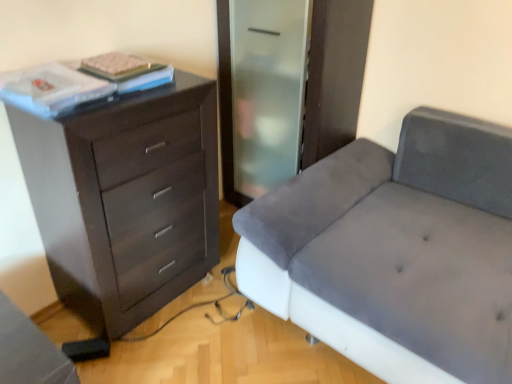
The image size is (512, 384). What do you see at coordinates (125, 201) in the screenshot? I see `dark wood chest of drawers at left` at bounding box center [125, 201].

The height and width of the screenshot is (384, 512). I want to click on dark wood chest of drawers at left, so click(x=125, y=201).

Who is smaller, white matte book at upper left or velvet grey couch at right?

With smaller size is white matte book at upper left.

Does white matte book at upper left turn towards velvet grey couch at right?

No, white matte book at upper left is not oriented towards velvet grey couch at right.

From a real-world perspective, is white matte book at upper left physically located above or below velvet grey couch at right?

white matte book at upper left is situated higher than velvet grey couch at right in the real world.

Choose the correct answer: Is white matte book at upper left inside velvet grey couch at right or outside it?

white matte book at upper left is located beyond the bounds of velvet grey couch at right.

In the scene shown: Considering the positions of objects velvet grey couch at right and dark wood chest of drawers at left in the image provided, who is more to the right, velvet grey couch at right or dark wood chest of drawers at left?

velvet grey couch at right is more to the right.

Who is bigger, velvet grey couch at right or dark wood chest of drawers at left?

With larger size is velvet grey couch at right.

Is velvet grey couch at right taller or shorter than dark wood chest of drawers at left?

Considering their sizes, velvet grey couch at right has less height than dark wood chest of drawers at left.

From a real-world perspective, is velvet grey couch at right over dark wood chest of drawers at left?

No, from a real-world perspective, velvet grey couch at right is not over dark wood chest of drawers at left

Locate an element on the screen. The image size is (512, 384). book above the dark wood chest of drawers at left (from the image's perspective) is located at coordinates 127,71.

From a real-world perspective, which is physically above, white matte book at upper left or dark wood chest of drawers at left?

From a 3D spatial view, white matte book at upper left is above.

From the image's perspective, which is below, white matte book at upper left or dark wood chest of drawers at left?

dark wood chest of drawers at left is shown below in the image.

Consider the image. Is dark wood chest of drawers at left wider or thinner than velvet grey couch at right?

In the image, dark wood chest of drawers at left appears to be more narrow than velvet grey couch at right.

Is dark wood chest of drawers at left inside the boundaries of velvet grey couch at right, or outside?

dark wood chest of drawers at left lies outside velvet grey couch at right.

The image size is (512, 384). What are the coordinates of `chest of drawers on the left of velvet grey couch at right` in the screenshot? It's located at (125, 201).

From the image's perspective, which one is positioned higher, dark wood chest of drawers at left or velvet grey couch at right?

dark wood chest of drawers at left.

Is velvet grey couch at right oriented away from white matte book at upper left?

That's not correct — velvet grey couch at right is not looking away from white matte book at upper left.

Is velvet grey couch at right to the left or to the right of white matte book at upper left in the image?

Based on their positions, velvet grey couch at right is located to the right of white matte book at upper left.

Does point (334, 300) appear closer or farther from the camera than point (137, 74)?

Point (334, 300) is closer to the camera than point (137, 74).

Does velvet grey couch at right contain white matte book at upper left?

That's incorrect, white matte book at upper left is not inside velvet grey couch at right.

Looking at this image, is dark wood chest of drawers at left positioned with its back to white matte book at upper left?

That's not correct — dark wood chest of drawers at left is not looking away from white matte book at upper left.

Considering the relative positions of dark wood chest of drawers at left and white matte book at upper left in the image provided, is dark wood chest of drawers at left to the left or to the right of white matte book at upper left?

dark wood chest of drawers at left is to the right of white matte book at upper left.

From a real-world perspective, who is located lower, dark wood chest of drawers at left or white matte book at upper left?

In real-world perspective, dark wood chest of drawers at left is lower.

Looking at the image, does dark wood chest of drawers at left seem bigger or smaller compared to white matte book at upper left?

Considering their sizes, dark wood chest of drawers at left takes up more space than white matte book at upper left.

You are a GUI agent. You are given a task and a screenshot of the screen. Output one action in this format:
    pyautogui.click(x=<x>, y=<y>)
    Task: Click on the studio couch that appears in front of the white matte book at upper left
    
    Given the screenshot: What is the action you would take?
    pyautogui.click(x=395, y=251)

Identify the location of chest of drawers to the left of velvet grey couch at right. (125, 201).

Estimate the real-world distances between objects in this image. Which object is closer to white matte book at upper left, velvet grey couch at right or dark wood chest of drawers at left?

Based on the image, dark wood chest of drawers at left appears to be nearer to white matte book at upper left.

Based on their spatial positions, is dark wood chest of drawers at left or velvet grey couch at right closer to white matte book at upper left?

Based on the image, dark wood chest of drawers at left appears to be nearer to white matte book at upper left.

Looking at the image, which one is located closer to velvet grey couch at right, white matte book at upper left or dark wood chest of drawers at left?

Based on the image, dark wood chest of drawers at left appears to be nearer to velvet grey couch at right.

Which object lies further to the anchor point dark wood chest of drawers at left, velvet grey couch at right or white matte book at upper left?

velvet grey couch at right is positioned further to the anchor dark wood chest of drawers at left.

Estimate the real-world distances between objects in this image. Which object is closer to dark wood chest of drawers at left, white matte book at upper left or velvet grey couch at right?

white matte book at upper left is positioned closer to the anchor dark wood chest of drawers at left.

Considering their positions, is dark wood chest of drawers at left positioned further to velvet grey couch at right than white matte book at upper left?

Based on the image, white matte book at upper left appears to be further to velvet grey couch at right.

Identify the location of chest of drawers between white matte book at upper left and velvet grey couch at right in the horizontal direction. Image resolution: width=512 pixels, height=384 pixels. (125, 201).